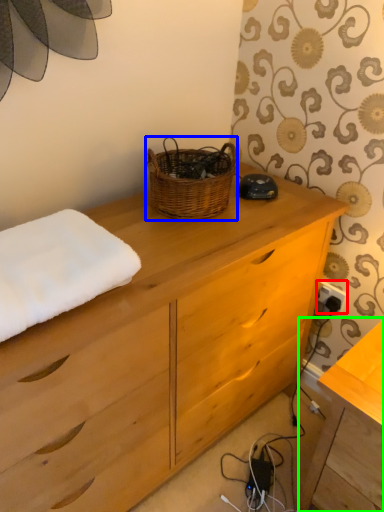
Question: Considering the real-world distances, which object is closest to electric outlet (highlighted by a red box)? picnic basket (highlighted by a blue box) or table (highlighted by a green box).

Choices:
 (A) picnic basket
 (B) table

Answer: (B)